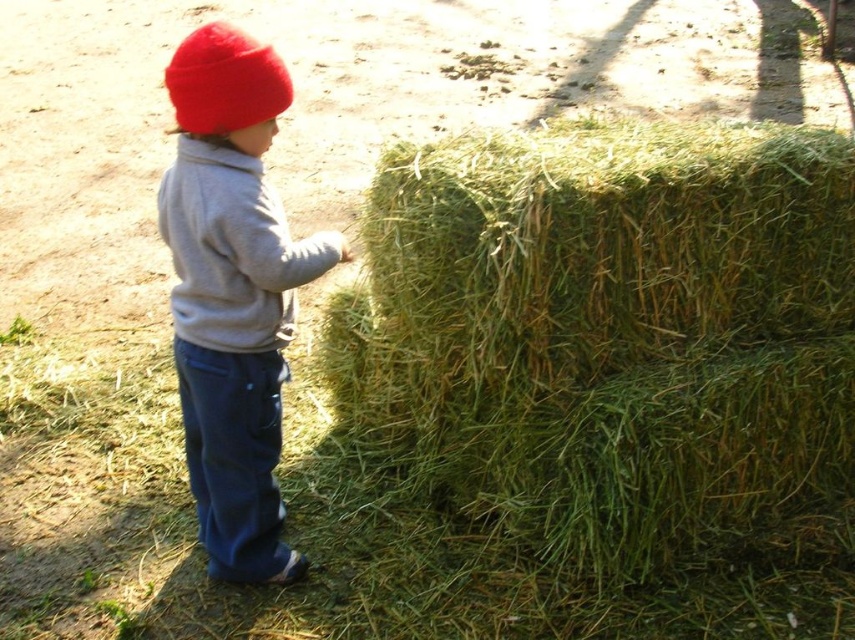
Question: Estimate the real-world distances between objects in this image. Which object is farther from the red fleece beanie at upper left?

Choices:
 (A) matte gray sweatshirt at center
 (B) green straw bale at center
 (C) gray fleece sweatshirt at center

Answer: (B)

Question: Can you confirm if green straw bale at center is thinner than matte gray sweatshirt at center?

Choices:
 (A) no
 (B) yes

Answer: (A)

Question: Can you confirm if green straw bale at center is thinner than red fleece beanie at upper left?

Choices:
 (A) no
 (B) yes

Answer: (A)

Question: Estimate the real-world distances between objects in this image. Which object is closer to the green straw bale at center?

Choices:
 (A) red fleece beanie at upper left
 (B) matte gray sweatshirt at center
 (C) gray fleece sweatshirt at center

Answer: (B)

Question: Which of the following is the farthest from the observer?

Choices:
 (A) (190, 77)
 (B) (534, 547)

Answer: (B)

Question: Can you confirm if green straw bale at center is positioned to the right of gray fleece sweatshirt at center?

Choices:
 (A) no
 (B) yes

Answer: (B)